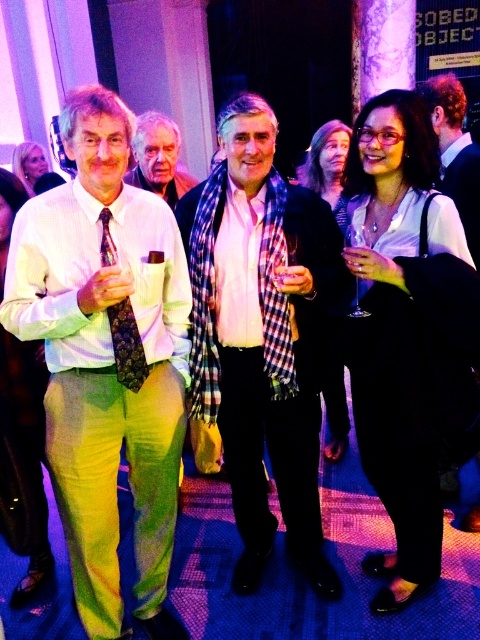
Question: Which object appears closest to the camera in this image?

Choices:
 (A) dark brown hair at upper right
 (B) plaid scarf at center
 (C) matte black scarf at center
 (D) white striped shirt at left

Answer: (D)

Question: Which object is the closest to the plaid scarf at center?

Choices:
 (A) matte black scarf at center
 (B) white striped shirt at left
 (C) dark brown hair at upper right

Answer: (B)

Question: Is plaid scarf at center positioned before matte black scarf at center?

Choices:
 (A) yes
 (B) no

Answer: (A)

Question: Which object is the farthest from the dark brown hair at upper right?

Choices:
 (A) plaid scarf at center
 (B) dark purple floral tie at left
 (C) matte black scarf at center
 (D) white striped shirt at left

Answer: (D)

Question: Is plaid scarf at center to the right of dark brown hair at upper right from the viewer's perspective?

Choices:
 (A) no
 (B) yes

Answer: (A)

Question: Is matte black scarf at center bigger than dark purple floral tie at left?

Choices:
 (A) yes
 (B) no

Answer: (A)